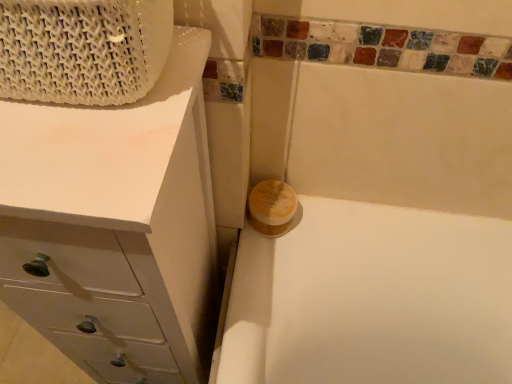
Question: Should I look upward or downward to see yellow matte soap at center?

Choices:
 (A) down
 (B) up

Answer: (A)

Question: From the image's perspective, is yellow matte soap at center under white matte chest of drawers at upper left?

Choices:
 (A) yes
 (B) no

Answer: (B)

Question: Considering the relative positions of yellow matte soap at center and white matte chest of drawers at upper left in the image provided, is yellow matte soap at center behind white matte chest of drawers at upper left?

Choices:
 (A) no
 (B) yes

Answer: (B)

Question: Are yellow matte soap at center and white matte chest of drawers at upper left making contact?

Choices:
 (A) no
 (B) yes

Answer: (A)

Question: From a real-world perspective, is yellow matte soap at center beneath white matte chest of drawers at upper left?

Choices:
 (A) no
 (B) yes

Answer: (A)

Question: From the image's perspective, would you say yellow matte soap at center is positioned over white matte chest of drawers at upper left?

Choices:
 (A) yes
 (B) no

Answer: (A)

Question: Is yellow matte soap at center positioned beyond the bounds of white matte chest of drawers at upper left?

Choices:
 (A) no
 (B) yes

Answer: (B)

Question: Considering the relative sizes of white matte chest of drawers at upper left and yellow matte soap at center in the image provided, is white matte chest of drawers at upper left thinner than yellow matte soap at center?

Choices:
 (A) yes
 (B) no

Answer: (B)

Question: Is white matte chest of drawers at upper left placed right next to yellow matte soap at center?

Choices:
 (A) yes
 (B) no

Answer: (B)

Question: Is white matte chest of drawers at upper left positioned behind yellow matte soap at center?

Choices:
 (A) no
 (B) yes

Answer: (A)

Question: Is white matte chest of drawers at upper left in front of yellow matte soap at center?

Choices:
 (A) no
 (B) yes

Answer: (B)

Question: Is white matte chest of drawers at upper left located outside yellow matte soap at center?

Choices:
 (A) yes
 (B) no

Answer: (A)

Question: Can you confirm if white matte chest of drawers at upper left is smaller than yellow matte soap at center?

Choices:
 (A) yes
 (B) no

Answer: (B)

Question: Considering the relative positions of yellow matte soap at center and white woven basket at upper left in the image provided, is yellow matte soap at center in front of white woven basket at upper left?

Choices:
 (A) no
 (B) yes

Answer: (A)